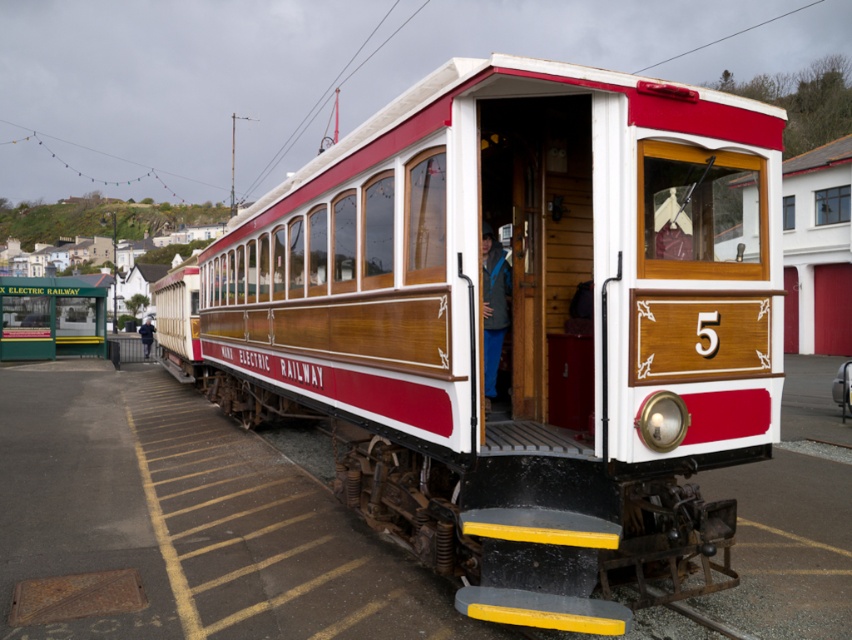
Does wooden panel train at center appear on the left side of blue denim pants at center?

Correct, you'll find wooden panel train at center to the left of blue denim pants at center.

Between wooden panel train at center and blue denim pants at center, which one is positioned higher?

blue denim pants at center is above.

At what (x,y) coordinates should I click in order to perform the action: click on wooden panel train at center. Please return your answer as a coordinate pair (x, y). The image size is (852, 640). Looking at the image, I should click on (517, 326).

Is wooden panel train at center closer to the viewer compared to dark blue jacket at center?

Yes, wooden panel train at center is closer to the viewer.

Is wooden panel train at center bigger than dark blue jacket at center?

Correct, wooden panel train at center is larger in size than dark blue jacket at center.

What do you see at coordinates (517, 326) in the screenshot?
I see `wooden panel train at center` at bounding box center [517, 326].

I want to click on wooden panel train at center, so click(x=517, y=326).

Is point (505, 291) more distant than point (148, 333)?

No, it is not.

You are a GUI agent. You are given a task and a screenshot of the screen. Output one action in this format:
    pyautogui.click(x=<x>, y=<y>)
    Task: Click on the blue denim pants at center
    This screenshot has height=640, width=852.
    Given the screenshot: What is the action you would take?
    pyautogui.click(x=493, y=307)